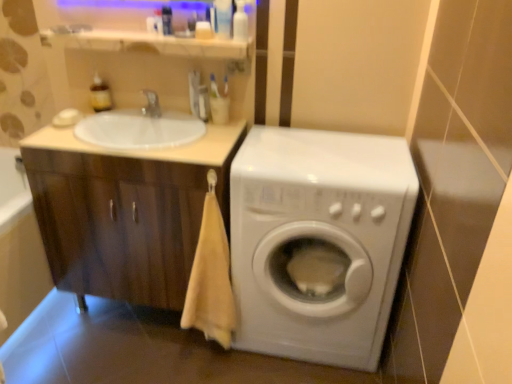
At what (x,y) coordinates should I click in order to perform the action: click on empty space that is to the right of translucent amber bottle at upper left, which is the first toiletry from left to right. Please return your answer as a coordinate pair (x, y). The image size is (512, 384). Looking at the image, I should click on (126, 116).